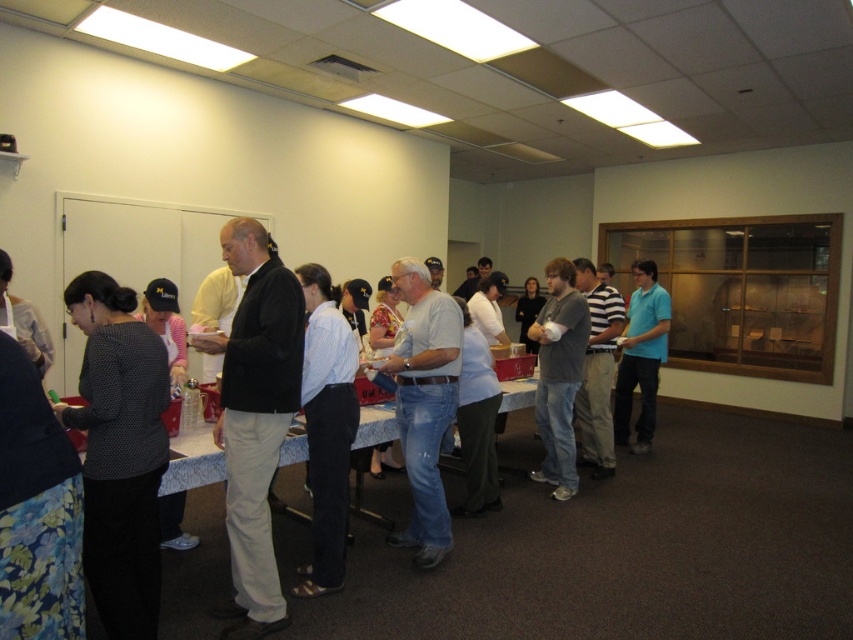
Question: Does polka dot blouse at left appear on the right side of denim jeans at center?

Choices:
 (A) yes
 (B) no

Answer: (B)

Question: Is light beige pants at center above light blue striped shirt at center?

Choices:
 (A) yes
 (B) no

Answer: (A)

Question: Based on their relative distances, which object is nearer to the light blue striped shirt at center?

Choices:
 (A) gray cotton shirt at center
 (B) light blue shirt at center
 (C) blue cotton shirt at center
 (D) polka dot blouse at left

Answer: (D)

Question: Which is farther from the blue cotton shirt at center?

Choices:
 (A) gray cotton shirt at center
 (B) light beige pants at center
 (C) light blue shirt at center

Answer: (B)

Question: Is the position of blue cotton shirt at center less distant than that of striped cotton shirt at center?

Choices:
 (A) yes
 (B) no

Answer: (B)

Question: Estimate the real-world distances between objects in this image. Which object is closer to the light blue striped shirt at center?

Choices:
 (A) blue cotton shirt at center
 (B) light blue shirt at center

Answer: (B)